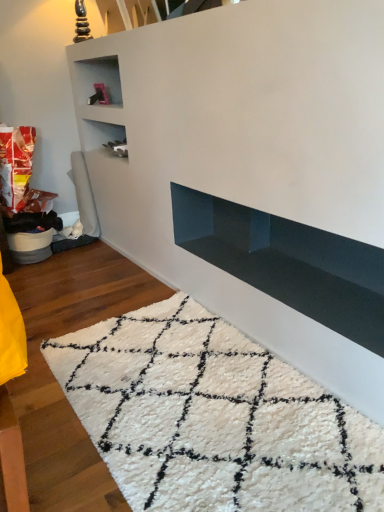
The width and height of the screenshot is (384, 512). Describe the element at coordinates (288, 262) in the screenshot. I see `glossy dark blue shelf at lower center` at that location.

Identify the location of glossy dark blue shelf at lower center. (288, 262).

This screenshot has height=512, width=384. What do you see at coordinates (213, 417) in the screenshot?
I see `white shaggy rug at lower center` at bounding box center [213, 417].

What is the approximate width of white shaggy rug at lower center?

white shaggy rug at lower center is 4.19 feet in width.

The height and width of the screenshot is (512, 384). What are the coordinates of `white shaggy rug at lower center` in the screenshot? It's located at (213, 417).

In order to click on glossy dark blue shelf at lower center in this screenshot , I will do `click(288, 262)`.

Considering the positions of objects glossy dark blue shelf at lower center and white shaggy rug at lower center in the image provided, who is more to the left, glossy dark blue shelf at lower center or white shaggy rug at lower center?

Positioned to the left is white shaggy rug at lower center.

Considering the positions of objects glossy dark blue shelf at lower center and white shaggy rug at lower center in the image provided, who is behind, glossy dark blue shelf at lower center or white shaggy rug at lower center?

glossy dark blue shelf at lower center is behind.

Is point (242, 279) closer or farther from the camera than point (129, 375)?

Point (242, 279) is positioned farther from the camera compared to point (129, 375).

From the image's perspective, is glossy dark blue shelf at lower center above white shaggy rug at lower center?

Yes, from the image's perspective, glossy dark blue shelf at lower center is above white shaggy rug at lower center.

From a real-world perspective, who is located lower, glossy dark blue shelf at lower center or white shaggy rug at lower center?

In real-world perspective, white shaggy rug at lower center is lower.

Considering the sizes of objects glossy dark blue shelf at lower center and white shaggy rug at lower center in the image provided, who is thinner, glossy dark blue shelf at lower center or white shaggy rug at lower center?

Thinner between the two is glossy dark blue shelf at lower center.

Who is shorter, glossy dark blue shelf at lower center or white shaggy rug at lower center?

white shaggy rug at lower center.

Considering the sizes of objects glossy dark blue shelf at lower center and white shaggy rug at lower center in the image provided, who is bigger, glossy dark blue shelf at lower center or white shaggy rug at lower center?

Bigger between the two is white shaggy rug at lower center.

Consider the image. Is white shaggy rug at lower center a part of glossy dark blue shelf at lower center?

No, white shaggy rug at lower center is not a part of glossy dark blue shelf at lower center.

Is glossy dark blue shelf at lower center next to white shaggy rug at lower center and touching it?

They are not placed beside each other.

Does glossy dark blue shelf at lower center turn towards white shaggy rug at lower center?

No, glossy dark blue shelf at lower center is not oriented towards white shaggy rug at lower center.

What's the angular difference between glossy dark blue shelf at lower center and white shaggy rug at lower center's facing directions?

0.0384 degrees.

You are a GUI agent. You are given a task and a screenshot of the screen. Output one action in this format:
    pyautogui.click(x=<x>, y=<y>)
    Task: Click on the shelf above the white shaggy rug at lower center (from a real-world perspective)
    
    Given the screenshot: What is the action you would take?
    pyautogui.click(x=288, y=262)

Between white shaggy rug at lower center and glossy dark blue shelf at lower center, which one appears on the left side from the viewer's perspective?

From the viewer's perspective, white shaggy rug at lower center appears more on the left side.

Which object is closer to the camera, white shaggy rug at lower center or glossy dark blue shelf at lower center?

white shaggy rug at lower center is in front.

Does point (261, 486) appear closer or farther from the camera than point (373, 254)?

Point (261, 486) appears to be closer to the viewer than point (373, 254).

From the image's perspective, between white shaggy rug at lower center and glossy dark blue shelf at lower center, which one is located above?

glossy dark blue shelf at lower center, from the image's perspective.

Looking at this image, from a real-world perspective, is white shaggy rug at lower center physically located above or below glossy dark blue shelf at lower center?

white shaggy rug at lower center is below glossy dark blue shelf at lower center.

Which of these two, white shaggy rug at lower center or glossy dark blue shelf at lower center, is wider?

With larger width is white shaggy rug at lower center.

Can you confirm if white shaggy rug at lower center is taller than glossy dark blue shelf at lower center?

Incorrect, the height of white shaggy rug at lower center is not larger of that of glossy dark blue shelf at lower center.

Is white shaggy rug at lower center bigger than glossy dark blue shelf at lower center?

Yes.

Consider the image. Would you say white shaggy rug at lower center is inside or outside glossy dark blue shelf at lower center?

white shaggy rug at lower center is not enclosed by glossy dark blue shelf at lower center.

Based on the photo, is white shaggy rug at lower center not near glossy dark blue shelf at lower center?

Actually, white shaggy rug at lower center and glossy dark blue shelf at lower center are a little close together.

Is white shaggy rug at lower center oriented towards glossy dark blue shelf at lower center?

No, white shaggy rug at lower center does not turn towards glossy dark blue shelf at lower center.

Where is `mat beneath the glossy dark blue shelf at lower center (from a real-world perspective)`? mat beneath the glossy dark blue shelf at lower center (from a real-world perspective) is located at coordinates (213, 417).

The height and width of the screenshot is (512, 384). In order to click on shelf above the white shaggy rug at lower center (from a real-world perspective) in this screenshot , I will do [x=288, y=262].

Where is `shelf behind the white shaggy rug at lower center`? Image resolution: width=384 pixels, height=512 pixels. shelf behind the white shaggy rug at lower center is located at coordinates (288, 262).